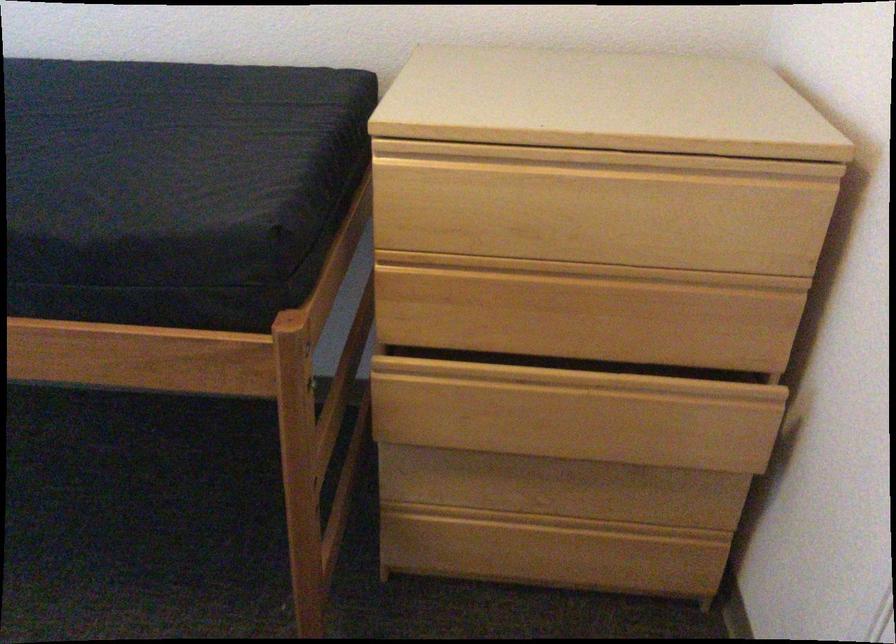
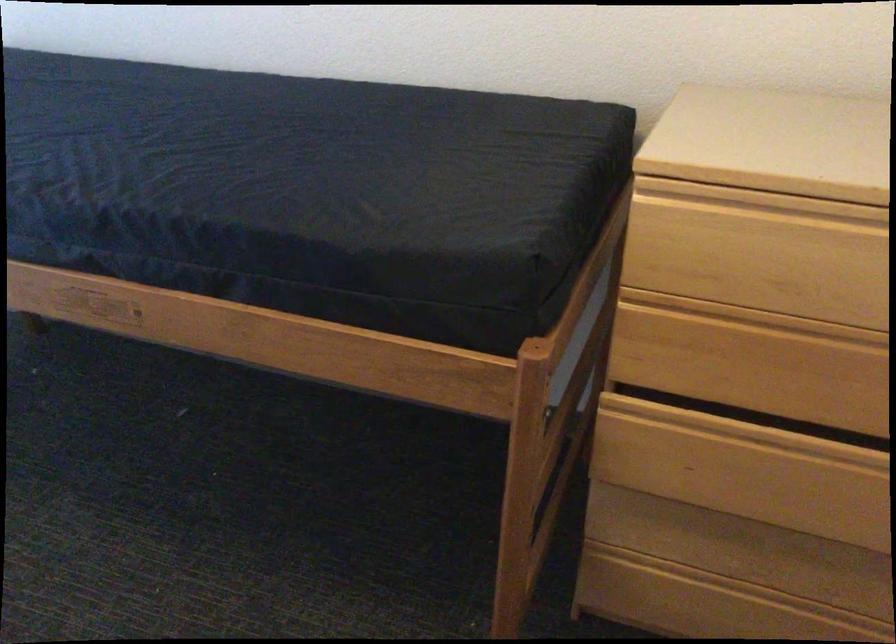
Question: How did the camera likely rotate?

Choices:
 (A) Left
 (B) Right
 (C) Up
 (D) Down

Answer: (A)